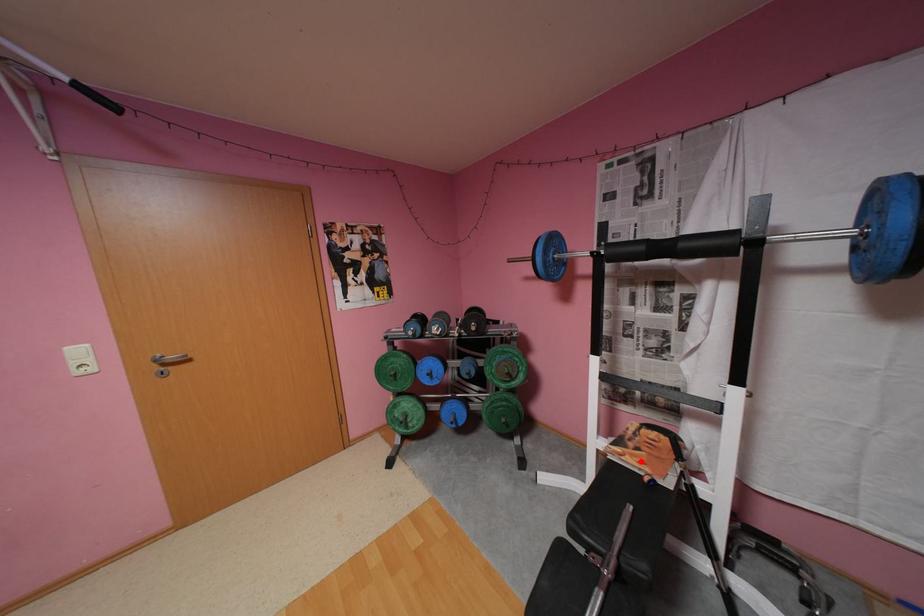
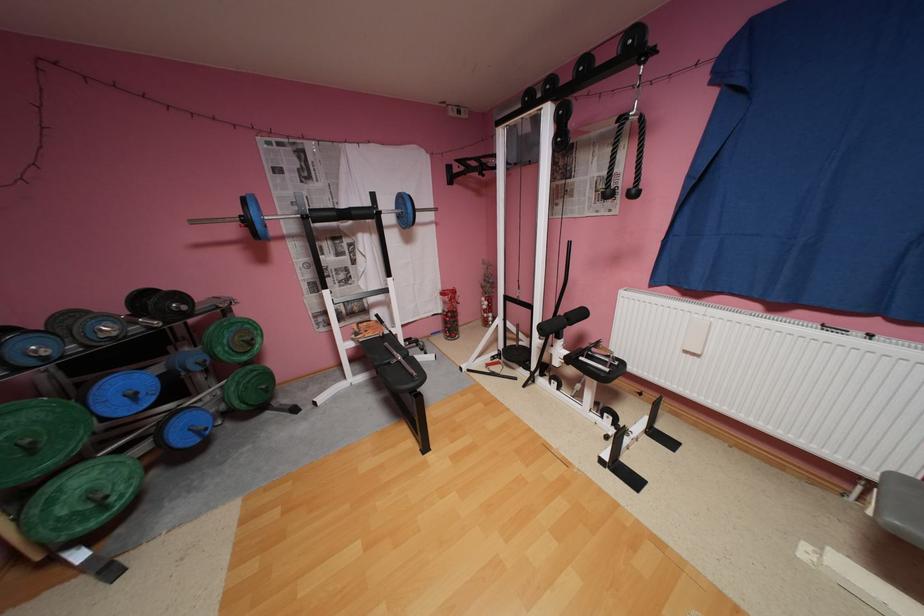
Question: I am providing you with two images of the same scene from different viewpoints. In image1, a red point is highlighted. Considering the same 3D point in image2, which of the following is correct?

Choices:
 (A) It is closer
 (B) It is farther

Answer: (A)